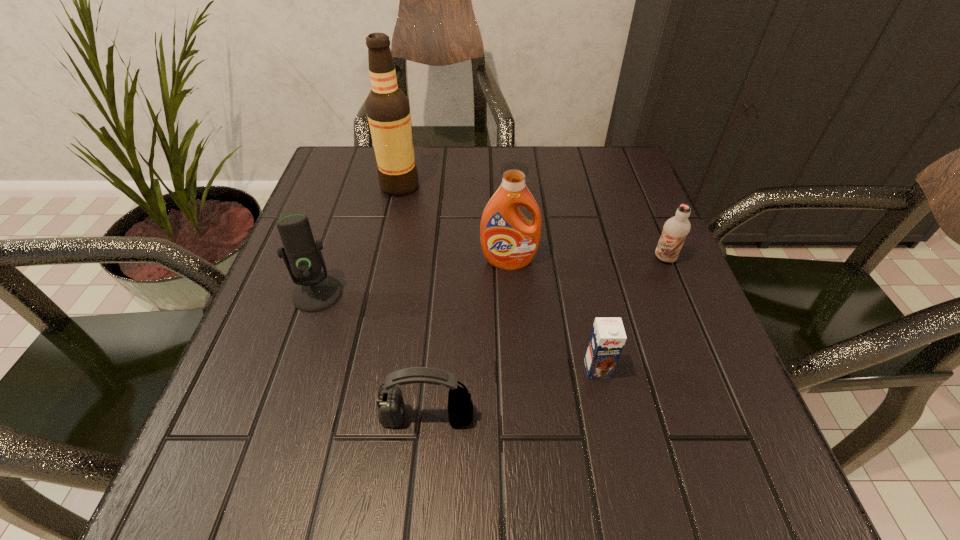
Identify the location of microphone that is at the left edge. This screenshot has height=540, width=960. (315, 291).

I want to click on object positioned at the right edge, so click(x=675, y=229).

Where is `object located at the far left corner`? Image resolution: width=960 pixels, height=540 pixels. object located at the far left corner is located at coordinates (387, 107).

Identify the location of free space at the far edge of the desktop. (572, 194).

This screenshot has width=960, height=540. I want to click on free region at the near edge, so click(x=343, y=462).

Find the location of a particular element. vacant space at the left edge of the desktop is located at coordinates (251, 353).

Identify the location of vacant space at the right edge of the desktop. (682, 321).

The width and height of the screenshot is (960, 540). I want to click on vacant space at the far left corner of the desktop, so click(320, 191).

Find the location of a particular element. This screenshot has width=960, height=540. vacant space at the far right corner of the desktop is located at coordinates (598, 184).

Find the location of a particular element. This screenshot has height=540, width=960. free space between the fourth object from left to right and the fourth shortest object is located at coordinates (413, 278).